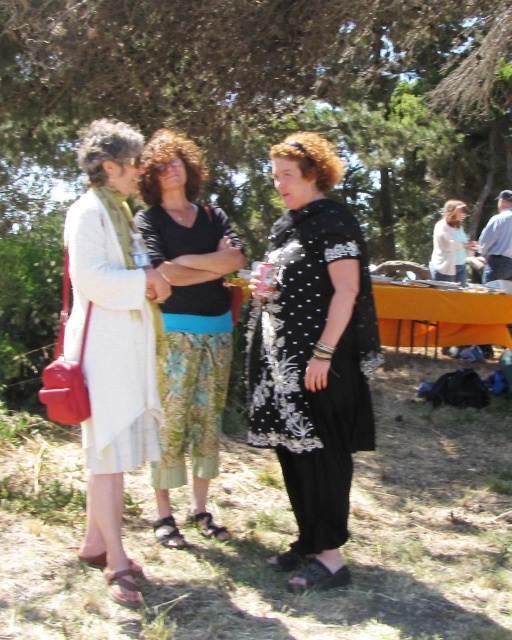
You are standing facing the group of three people. You need to deliver a package to the person wearing the green floral pants at center. Which direction should you walk relative to the person wearing the matte white dress at left?

You should walk to the right relative to the person wearing the matte white dress at left to reach the person wearing the green floral pants at center, since the matte white dress at left is positioned to the left of the green floral pants at center.

You are at a community event and want to approach the person wearing the black embroidered dress at center. Which direction should you move relative to the green floral pants at center?

You should move to the right of the green floral pants at center to reach the black embroidered dress at center.